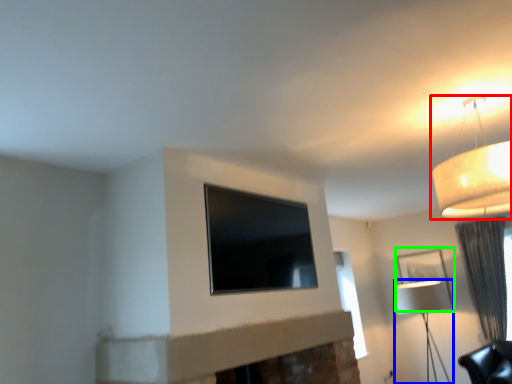
Question: Based on their relative distances, which object is nearer to lamp (highlighted by a red box)? Choose from lamp (highlighted by a blue box) and picture frame (highlighted by a green box).

Choices:
 (A) lamp
 (B) picture frame

Answer: (B)